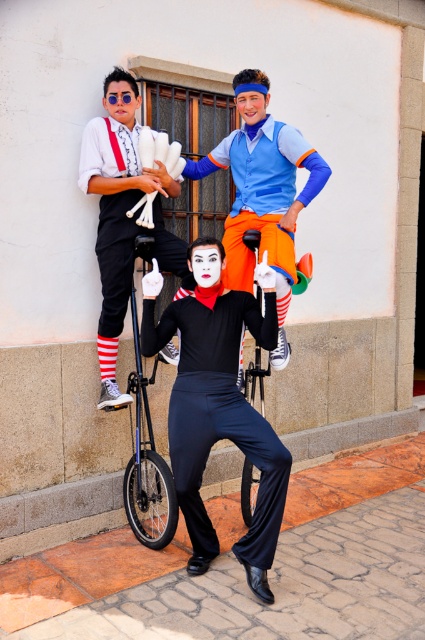
You are a GUI agent. You are given a task and a screenshot of the screen. Output one action in this format:
    pyautogui.click(x=<x>, y=<y>)
    Task: Click on the black satin pants at center
    This screenshot has height=640, width=425.
    Given the screenshot: What is the action you would take?
    pyautogui.click(x=218, y=412)

Is black satin pants at center thinner than matte white gloves at upper left?

Incorrect, black satin pants at center's width is not less than matte white gloves at upper left's.

Is point (192, 515) positioned before point (127, 196)?

That is True.

Where is `black satin pants at center`? This screenshot has width=425, height=640. black satin pants at center is located at coordinates (218, 412).

Between point (91, 170) and point (133, 490), which one is positioned in front?

Point (91, 170) is more forward.

Is matte white gloves at upper left bigger than shiny black monocycle at center?

Correct, matte white gloves at upper left is larger in size than shiny black monocycle at center.

Between point (130, 204) and point (141, 481), which one is positioned in front?

Positioned in front is point (141, 481).

Find the location of a particular element. matte white gloves at upper left is located at coordinates (116, 211).

Between black satin pants at center and shiny black monocycle at center, which one is positioned lower?

Positioned lower is black satin pants at center.

Which is more to the right, black satin pants at center or shiny black monocycle at center?

From the viewer's perspective, black satin pants at center appears more on the right side.

The width and height of the screenshot is (425, 640). I want to click on black satin pants at center, so click(x=218, y=412).

Find the location of a particular element. The height and width of the screenshot is (640, 425). black satin pants at center is located at coordinates (218, 412).